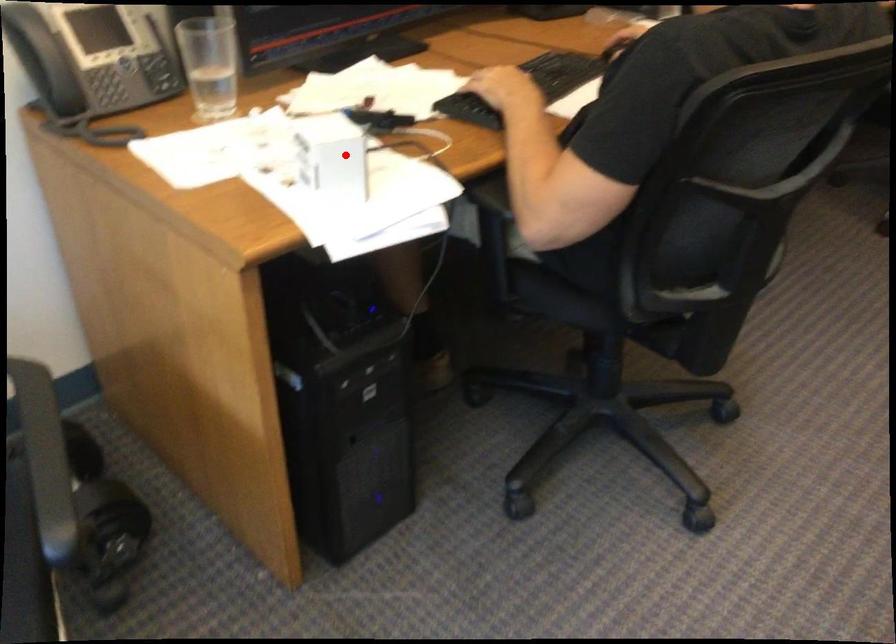
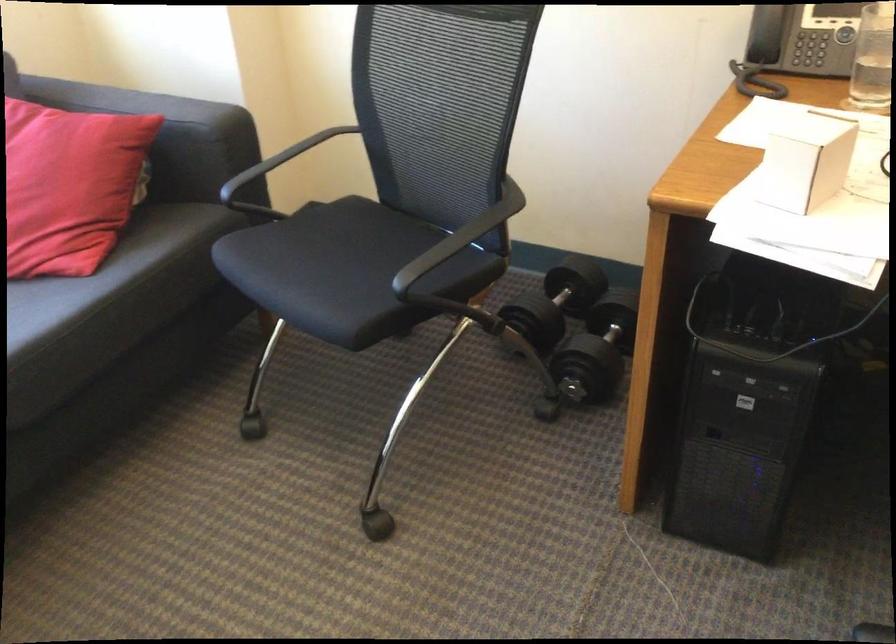
Find the pixel in the second image that matches the highlighted location in the first image.

(805, 162)